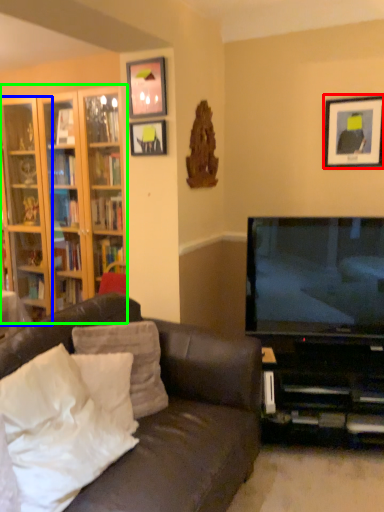
Question: Based on their relative distances, which object is nearer to picture frame (highlighted by a red box)? Choose from shelf (highlighted by a blue box) and cabinetry (highlighted by a green box).

Choices:
 (A) shelf
 (B) cabinetry

Answer: (B)